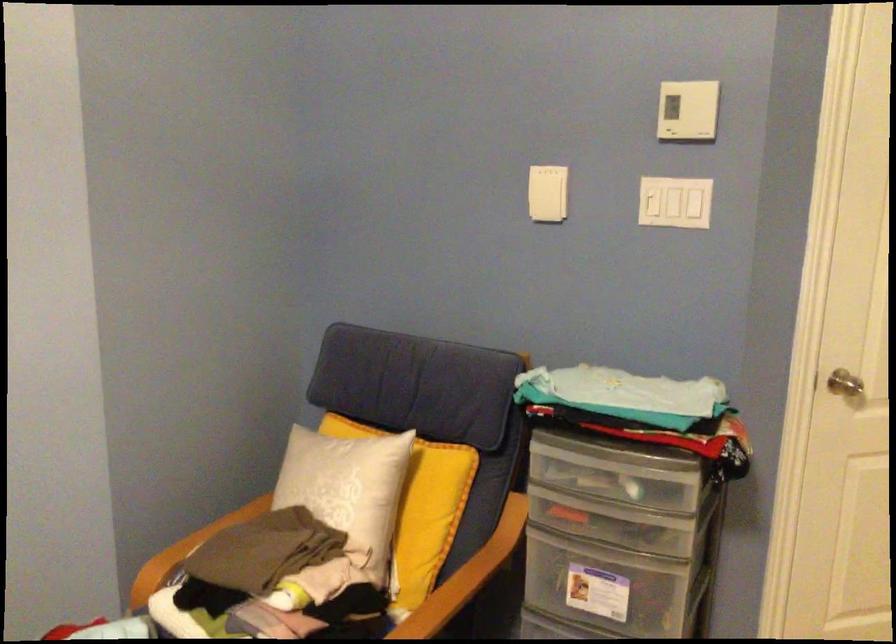
Find the location of `plastic drawer handle`. plastic drawer handle is located at coordinates (613, 468).